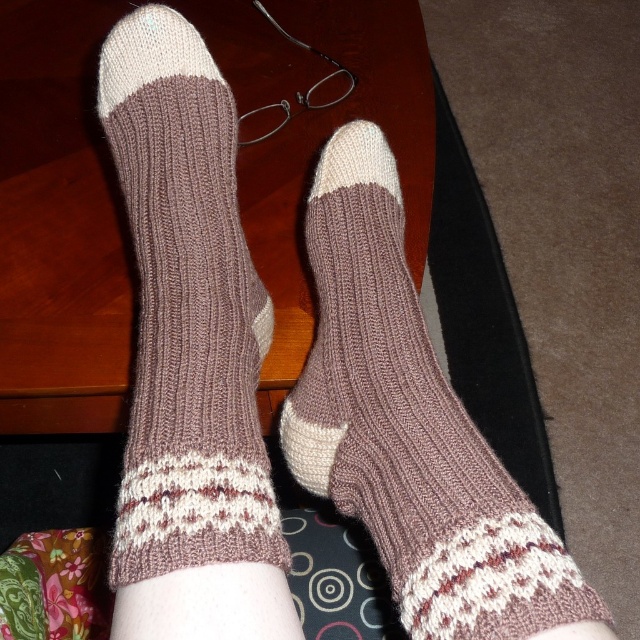
You are trying to determine if the brown knitted sock at center can fit into a drawer designed for the knit brown socks at center. Based on their widths, will it fit?

The brown knitted sock at center is wider than the knit brown socks at center, so it may not fit properly into the drawer designed for the knit brown socks at center.

Consider the image. You are organizing a sock display and need to arrange the brown knitted sock at center and the knit brown socks at center in a specific order. According to the image, which sock is positioned to the right of the other?

The brown knitted sock at center is to the right of the knit brown socks at center.

You are organizing a sock display and need to arrange the brown knitted sock at center and the knit brown socks at center on a shelf. According to the image, which one is positioned lower?

The brown knitted sock at center is located below knit brown socks at center, so it is positioned lower.